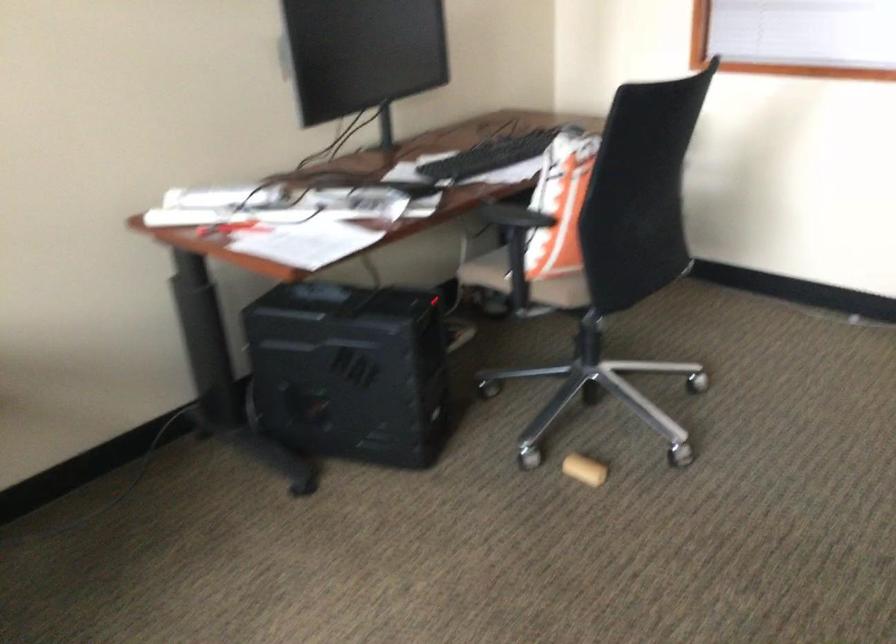
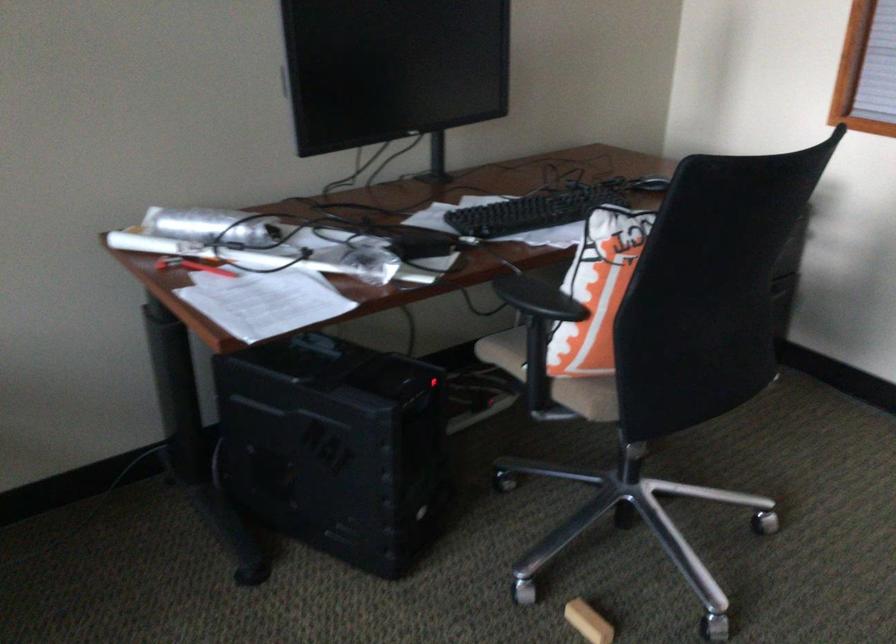
Where in the second image is the point corresponding to point 533,279 from the first image?

(552, 377)